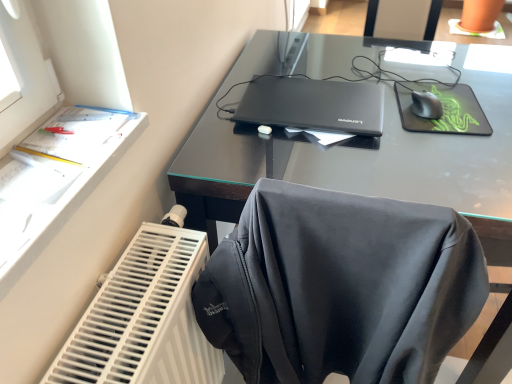
Where is `vacant space in between black matte laptop at center and black matte mouse at upper right`? This screenshot has height=384, width=512. vacant space in between black matte laptop at center and black matte mouse at upper right is located at coordinates 395,112.